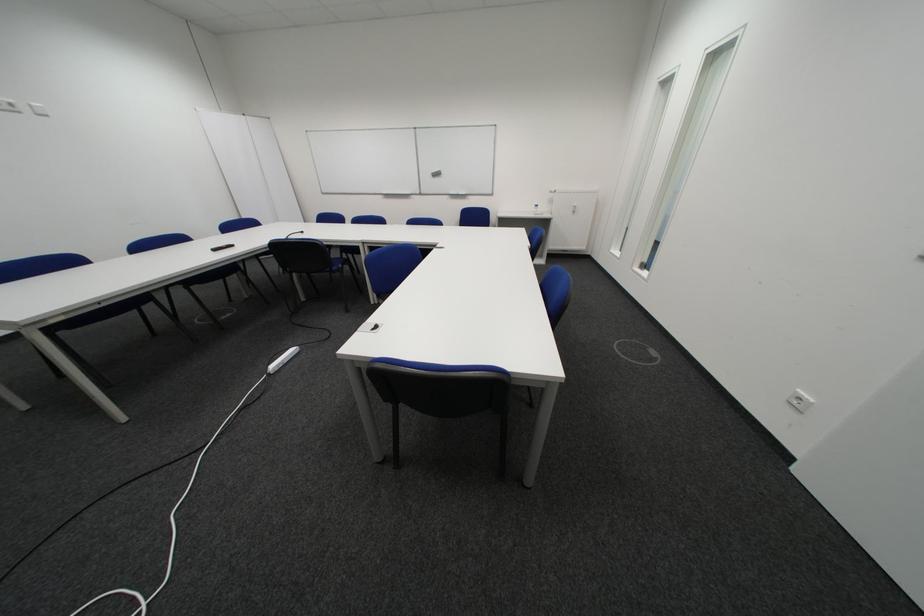
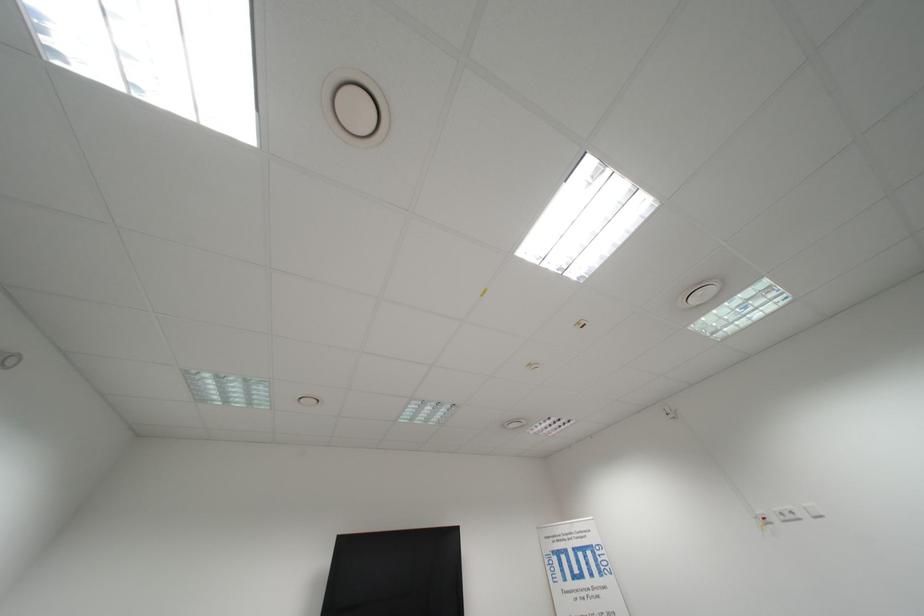
Find the pixel in the second image that matches [43,107] in the first image.

(818, 509)